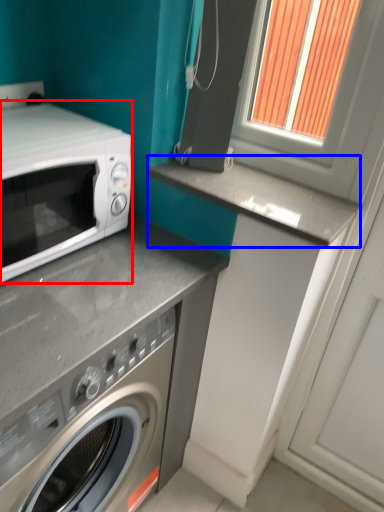
Question: Which of the following is the closest to the observer, microwave oven (highlighted by a red box) or counter top (highlighted by a blue box)?

Choices:
 (A) microwave oven
 (B) counter top

Answer: (A)